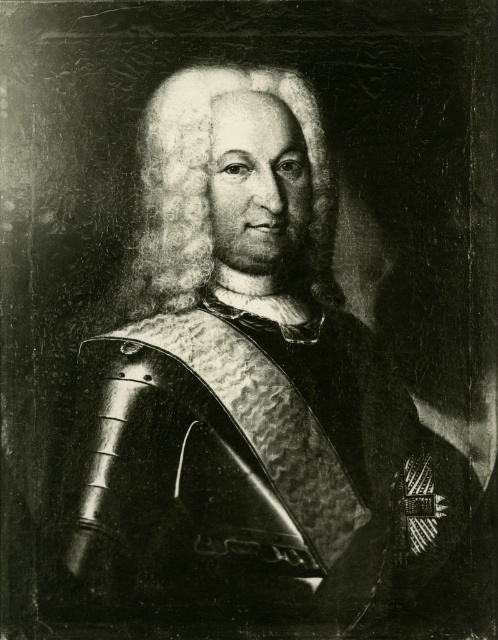
Looking at the portrait, you notice the man has both white textured hair at center and a white fluffy beard at center. Which of these features has a greater width?

The white textured hair at center has a greater width than the white fluffy beard at center.

From the picture: In the portrait, you notice the man has both white textured hair at center and a white fluffy beard at center. Which one is located more to the left?

The white textured hair at center is positioned on the left side of white fluffy beard at center, so it is more to the left.